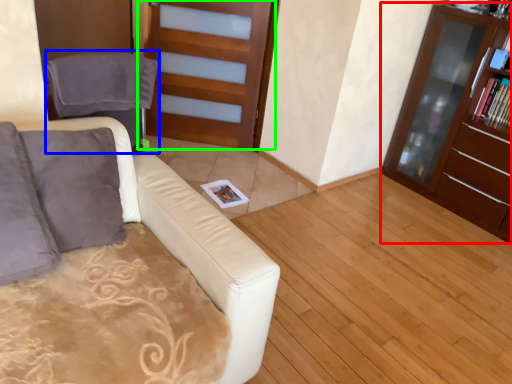
Question: Which object is the farthest from cabinetry (highlighted by a red box)? Choose among these: swivel chair (highlighted by a blue box) or door (highlighted by a green box).

Choices:
 (A) swivel chair
 (B) door

Answer: (A)